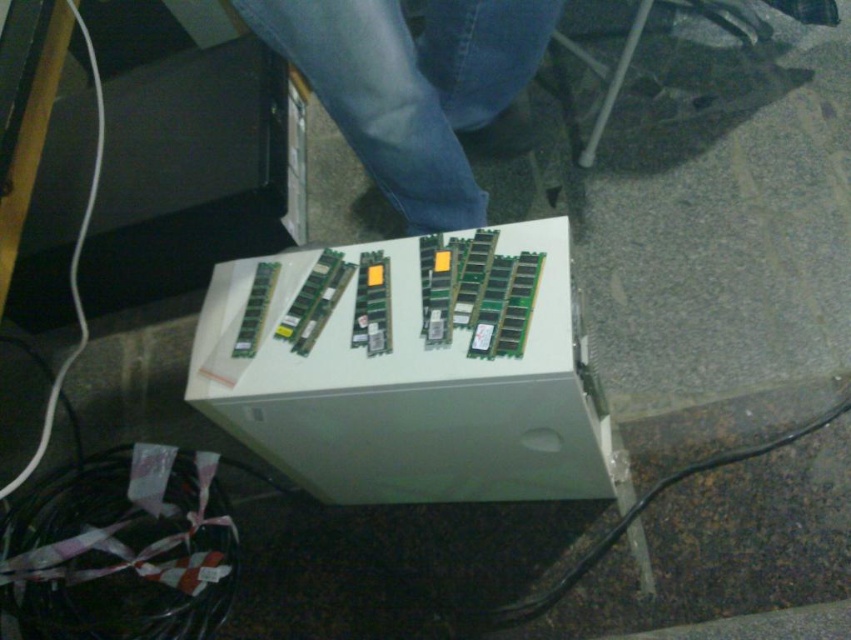
Who is more forward, (523, 467) or (471, 221)?

Point (523, 467) is more forward.

Does white plastic box at center have a smaller size compared to jeans at center?

No, white plastic box at center is not smaller than jeans at center.

Is point (370, 336) in front of point (263, 4)?

Yes, point (370, 336) is closer to viewer.

Where is `white plastic box at center`? white plastic box at center is located at coordinates (412, 369).

Can you confirm if white plastic box at center is positioned to the right of black rubber cable at lower right?

Incorrect, white plastic box at center is not on the right side of black rubber cable at lower right.

Is white plastic box at center bigger than black rubber cable at lower right?

Indeed, white plastic box at center has a larger size compared to black rubber cable at lower right.

Who is more distant from viewer, [529,412] or [458,628]?

Point [458,628]

Locate an element on the screen. The width and height of the screenshot is (851, 640). white plastic box at center is located at coordinates (412, 369).

Can you confirm if jeans at center is positioned below black rubber cable at lower right?

Actually, jeans at center is above black rubber cable at lower right.

Does jeans at center have a lesser height compared to black rubber cable at lower right?

Correct, jeans at center is not as tall as black rubber cable at lower right.

Find the location of a particular element. jeans at center is located at coordinates (410, 84).